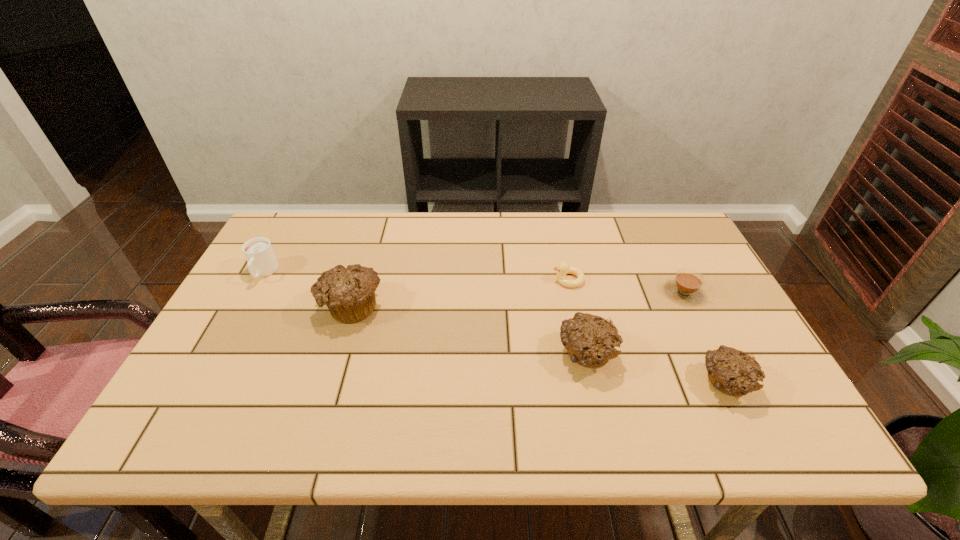
In the image, there is a desktop. Find the location of `blank space at the far edge`. blank space at the far edge is located at coordinates (462, 229).

At what (x,y) coordinates should I click in order to perform the action: click on free location at the near edge of the desktop. Please return your answer as a coordinate pair (x, y). This screenshot has height=540, width=960. Looking at the image, I should click on (532, 406).

The image size is (960, 540). Find the location of `free location at the left edge of the desktop`. free location at the left edge of the desktop is located at coordinates (258, 336).

You are a GUI agent. You are given a task and a screenshot of the screen. Output one action in this format:
    pyautogui.click(x=<x>, y=<y>)
    Task: Click on the free space at the right edge of the desktop
    This screenshot has width=960, height=540.
    Given the screenshot: What is the action you would take?
    pyautogui.click(x=726, y=303)

Identify the location of vacant position at the near left corner of the desktop. (223, 374).

Image resolution: width=960 pixels, height=540 pixels. Find the location of `vacant region at the far right corner`. vacant region at the far right corner is located at coordinates (638, 225).

Find the location of a particular element. free space between the farthest muffin and the leftmost object is located at coordinates (307, 289).

You are a GUI agent. You are given a task and a screenshot of the screen. Output one action in this format:
    pyautogui.click(x=<x>, y=<y>)
    Task: Click on the vacant area between the leftmost object and the second tallest muffin
    This screenshot has height=540, width=960.
    Given the screenshot: What is the action you would take?
    pyautogui.click(x=425, y=314)

I want to click on free point between the rightmost muffin and the second tallest muffin, so click(656, 369).

This screenshot has height=540, width=960. I want to click on free area in between the second shortest muffin and the taller cappuccino, so click(425, 314).